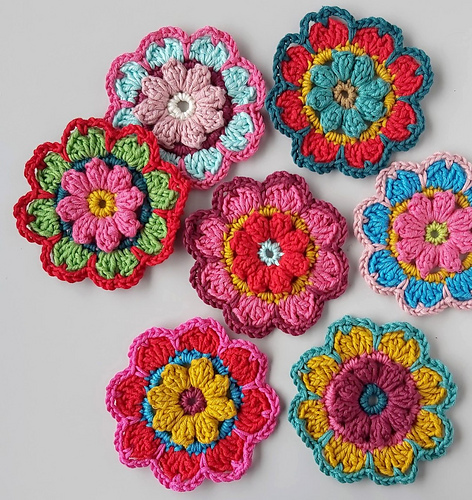
Locate an element on the screen. The height and width of the screenshot is (500, 472). decorations is located at coordinates (105, 215).